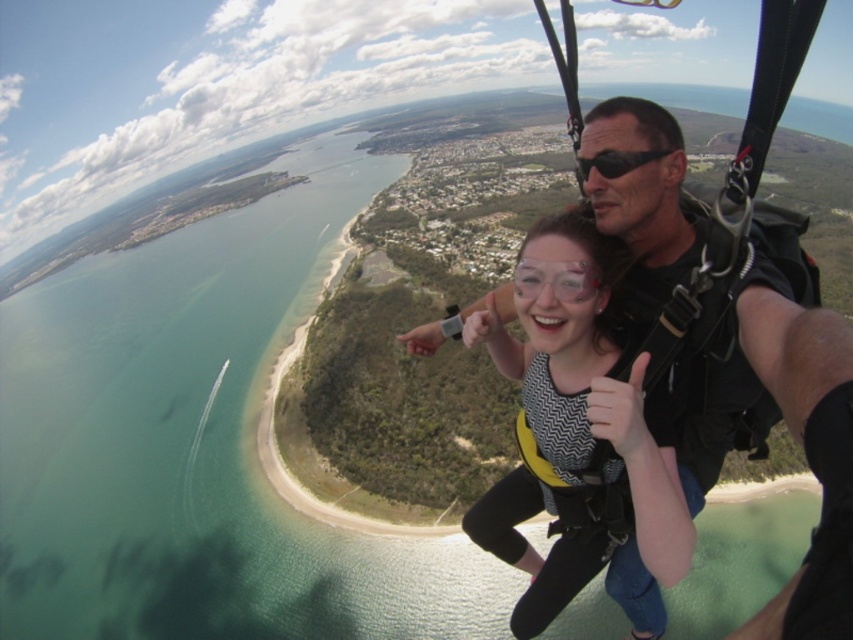
Question: Which is farther from the black matte goggles at upper center?

Choices:
 (A) yellow fabric harness at center
 (B) matte black harness at center

Answer: (B)

Question: Is matte black harness at center further to camera compared to yellow fabric harness at center?

Choices:
 (A) yes
 (B) no

Answer: (A)

Question: Is yellow fabric harness at center positioned at the back of black matte goggles at upper center?

Choices:
 (A) yes
 (B) no

Answer: (B)

Question: Which point appears closest to the camera in this image?

Choices:
 (A) (737, 372)
 (B) (605, 176)
 (C) (579, 429)

Answer: (A)

Question: Based on their relative distances, which object is nearer to the matte black harness at center?

Choices:
 (A) black matte goggles at upper center
 (B) yellow fabric harness at center

Answer: (B)

Question: Observing the image, what is the correct spatial positioning of matte black harness at center in reference to black matte goggles at upper center?

Choices:
 (A) above
 (B) below

Answer: (B)